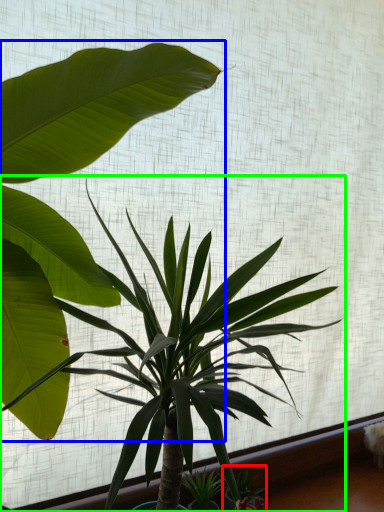
Question: Considering the real-world distances, which object is farthest from plant (highlighted by a red box)? houseplant (highlighted by a blue box) or houseplant (highlighted by a green box)?

Choices:
 (A) houseplant
 (B) houseplant

Answer: (A)